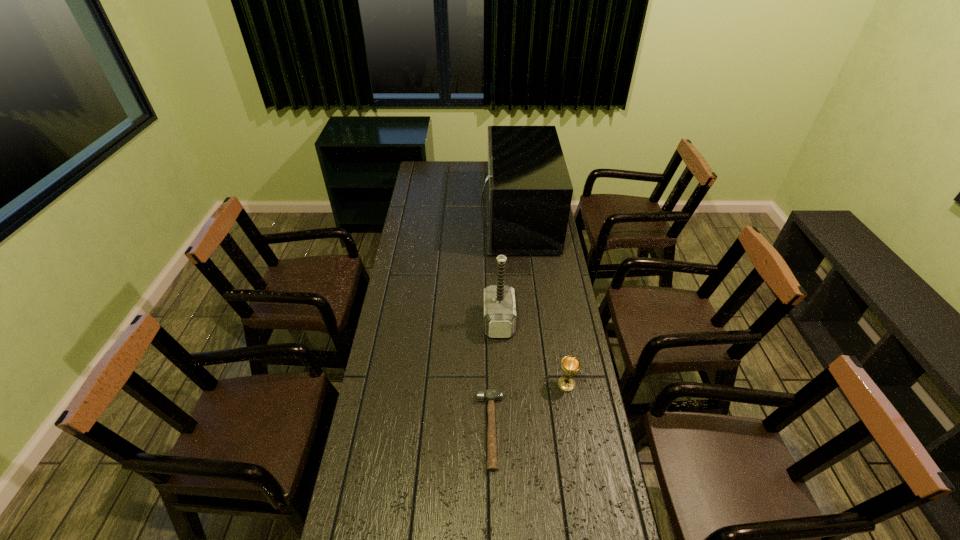
Find the location of a particular element. This screenshot has height=540, width=960. blank space at the right edge of the desktop is located at coordinates (575, 401).

Image resolution: width=960 pixels, height=540 pixels. Identify the location of free space at the far left corner of the desktop. click(x=427, y=170).

Locate an element on the screen. The width and height of the screenshot is (960, 540). vacant space in between the taller hammer and the nearer hammer is located at coordinates (494, 376).

Find the location of `free area in between the farthest object and the chalice`. free area in between the farthest object and the chalice is located at coordinates (541, 302).

At what (x,y) coordinates should I click in order to perform the action: click on vacant space in between the microwave oven and the farther hammer. Please return your answer as a coordinate pair (x, y). The width and height of the screenshot is (960, 540). Looking at the image, I should click on (508, 271).

This screenshot has height=540, width=960. I want to click on free area in between the third tallest object and the farthest object, so click(541, 302).

The image size is (960, 540). Identify the location of vacant region between the second shortest object and the third nearest object. (533, 353).

What are the coordinates of `free space between the second farthest object and the farthest object` in the screenshot? It's located at (508, 271).

Identify the location of free space between the second shortest object and the farthest object. The image size is (960, 540). (541, 302).

Identify the location of free spot between the farthest object and the chalice. (541, 302).